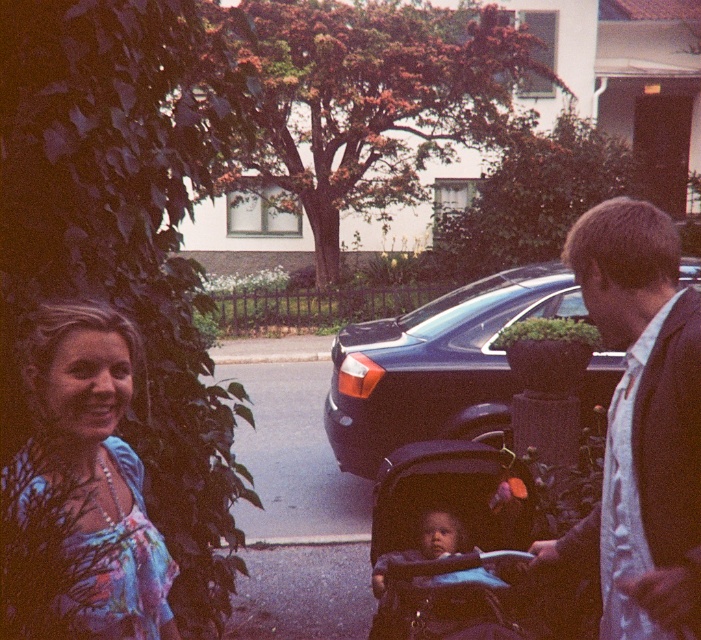
Question: Is dark blue fabric stroller at center behind shiny black car at center?

Choices:
 (A) yes
 (B) no

Answer: (B)

Question: Which of the following is the closest to the observer?

Choices:
 (A) (554, 584)
 (B) (243, 529)

Answer: (A)

Question: Which point is closer to the camera taking this photo?

Choices:
 (A) (667, 228)
 (B) (272, 518)

Answer: (A)

Question: Can you confirm if shiny black car at center is positioned above black asphalt pavement at center?

Choices:
 (A) no
 (B) yes

Answer: (B)

Question: Which point is farther from the camera taking this photo?

Choices:
 (A) [111, 422]
 (B) [271, 490]
 (C) [566, 314]
 (D) [658, 458]

Answer: (B)

Question: Can you confirm if dark brown suit at right is positioned above dark blue fabric stroller at center?

Choices:
 (A) no
 (B) yes

Answer: (B)